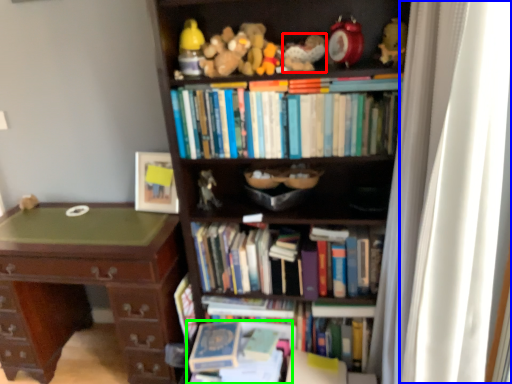
Question: Based on their relative distances, which object is farther from toy (highlighted by a red box)? Choose from curtain (highlighted by a blue box) and book (highlighted by a green box).

Choices:
 (A) curtain
 (B) book

Answer: (B)